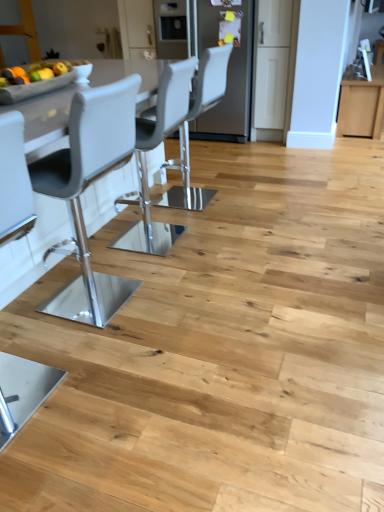
Question: From their relative heights in the image, would you say matte gray chair at left, which is the first chair from front to back, is taller or shorter than matte gray chair at center, which is the 1th chair in back-to-front order?

Choices:
 (A) tall
 (B) short

Answer: (A)

Question: In terms of width, does matte gray chair at left, placed as the second chair when sorted from back to front, look wider or thinner when compared to matte gray chair at center, placed as the 2th chair when sorted from bottom to top?

Choices:
 (A) thin
 (B) wide

Answer: (A)

Question: Estimate the real-world distances between objects in this image. Which object is farther from the matte gray chair at center, placed as the 2th chair when sorted from bottom to top?

Choices:
 (A) matte gray chair at left, the first chair viewed from the left
 (B) satin stainless steel refrigerator at center

Answer: (A)

Question: Considering the real-world distances, which object is closest to the matte gray chair at center, placed as the 2th chair when sorted from bottom to top?

Choices:
 (A) satin stainless steel refrigerator at center
 (B) matte gray chair at left, acting as the 2th chair starting from the top

Answer: (A)